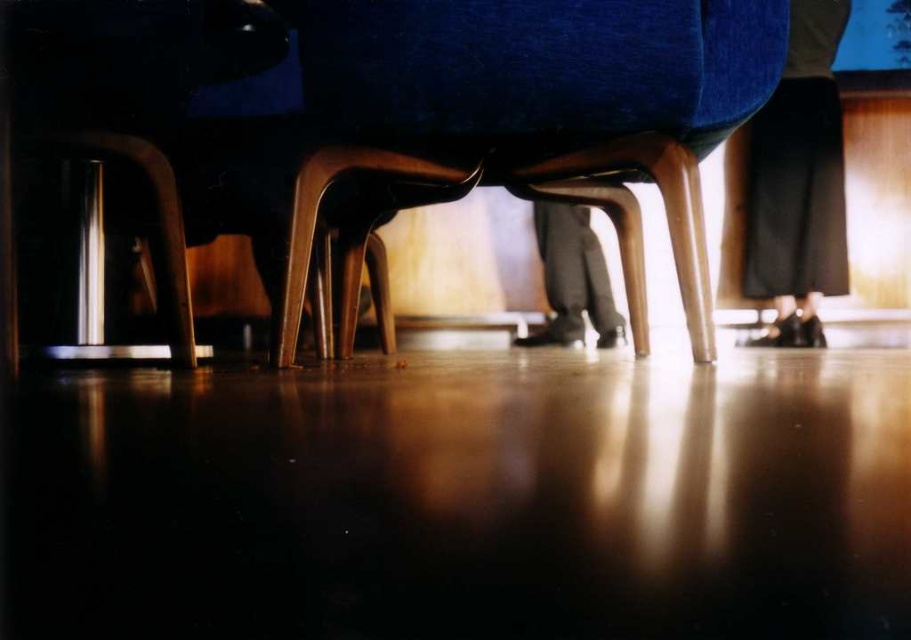
Question: Which object is closer to the camera taking this photo?

Choices:
 (A) velvet blue armchair at center
 (B) polished metal bar stool at lower left
 (C) dark gray pants at center
 (D) black leather shoes at lower right

Answer: (A)

Question: Estimate the real-world distances between objects in this image. Which object is closer to the black leather shoes at lower right?

Choices:
 (A) polished metal bar stool at lower left
 (B) dark gray pants at center
 (C) velvet blue armchair at center

Answer: (B)

Question: Does black leather shoes at lower right appear under dark gray pants at center?

Choices:
 (A) yes
 (B) no

Answer: (B)

Question: Is black leather shoes at lower right to the left of dark gray pants at center from the viewer's perspective?

Choices:
 (A) no
 (B) yes

Answer: (A)

Question: Which object is closer to the camera taking this photo?

Choices:
 (A) polished metal bar stool at lower left
 (B) dark gray pants at center
 (C) velvet blue armchair at center

Answer: (C)

Question: Is the position of black leather shoes at lower right more distant than that of dark gray pants at center?

Choices:
 (A) no
 (B) yes

Answer: (A)